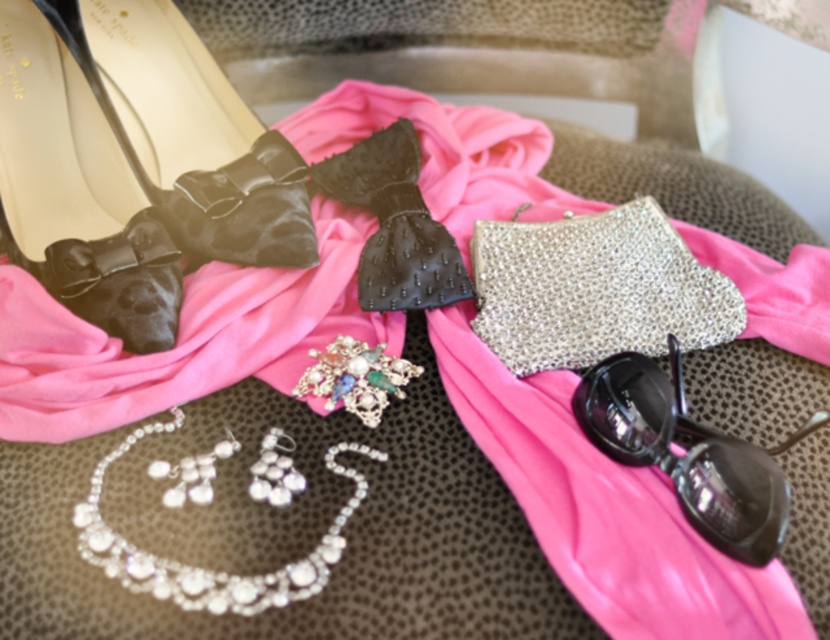
Question: Which point is farther to the camera?

Choices:
 (A) (201, 80)
 (B) (113, 321)
 (C) (525, 320)

Answer: (A)

Question: Can you confirm if matte black bow at upper left is positioned to the right of pearl/textured necklace at center?

Choices:
 (A) no
 (B) yes

Answer: (A)

Question: Which is nearer to the sparkly silver clutch at center?

Choices:
 (A) pearl/textured necklace at center
 (B) matte black bow at upper left
 (C) matte black sandal at upper left
 (D) pearl and gemstone brooch at center

Answer: (D)

Question: Which object is farther from the camera taking this photo?

Choices:
 (A) pearl and gemstone brooch at center
 (B) matte black bow at upper left

Answer: (B)

Question: Is matte black bow at upper left wider than pearl/textured necklace at center?

Choices:
 (A) no
 (B) yes

Answer: (A)

Question: Does matte black bow at upper left appear on the right side of pearl and gemstone brooch at center?

Choices:
 (A) no
 (B) yes

Answer: (A)